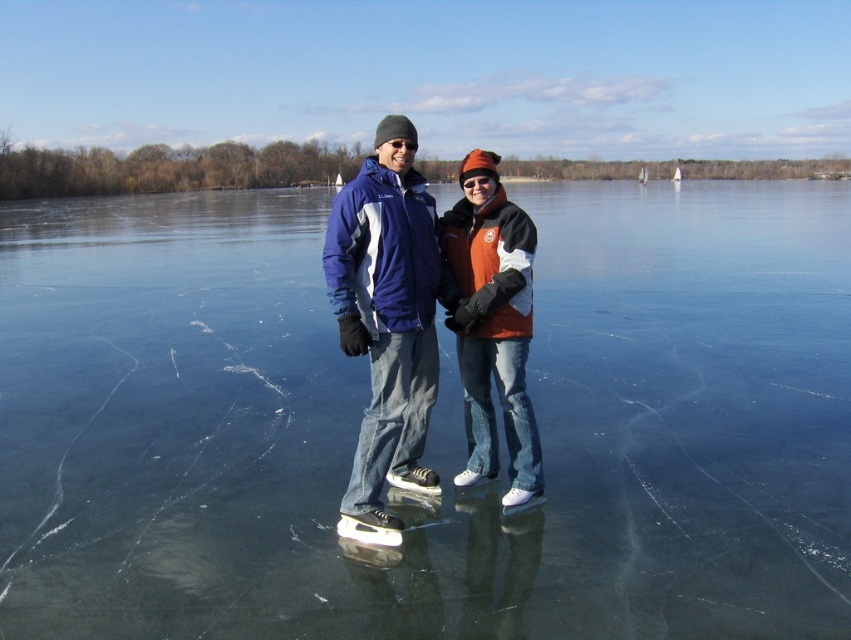
Is transparent ice at center to the right of matte blue jacket at center from the viewer's perspective?

In fact, transparent ice at center is to the left of matte blue jacket at center.

Is transparent ice at center to the left of matte blue jacket at center from the viewer's perspective?

Yes, transparent ice at center is to the left of matte blue jacket at center.

This screenshot has width=851, height=640. I want to click on transparent ice at center, so click(x=430, y=426).